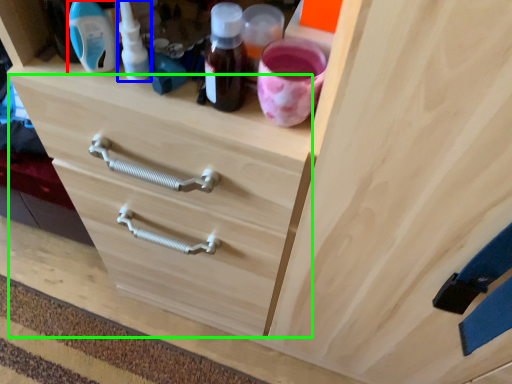
Question: Estimate the real-world distances between objects in this image. Which object is farther from bottle (highlighted by a red box), bottle (highlighted by a blue box) or drawer (highlighted by a green box)?

Choices:
 (A) bottle
 (B) drawer

Answer: (B)